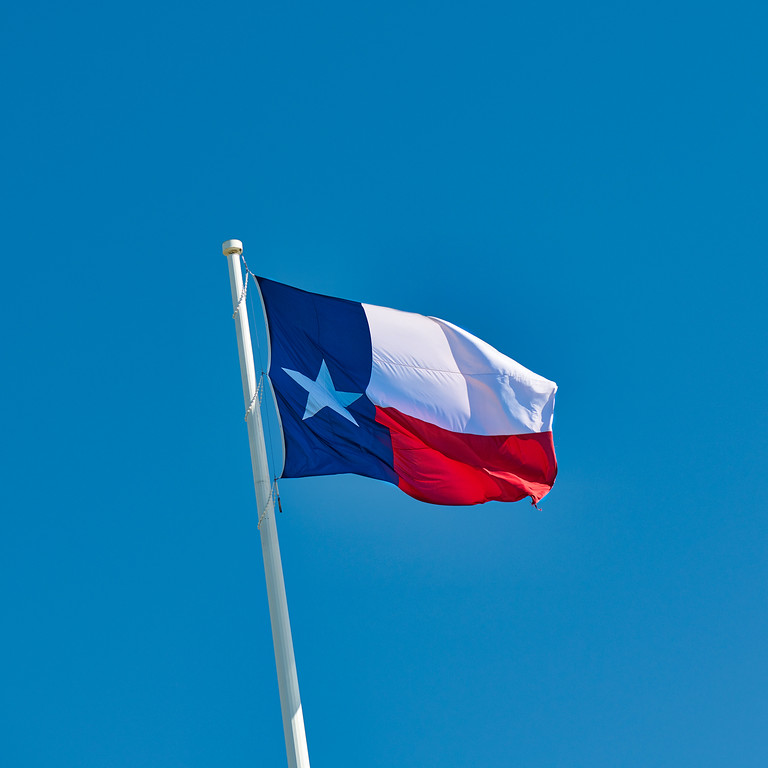
This screenshot has width=768, height=768. Identify the location of cable. point(273,492), point(243,290).